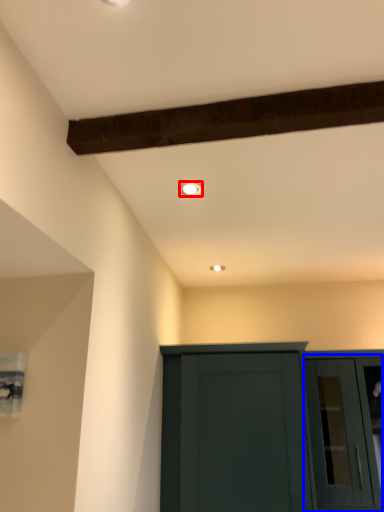
Question: Which object appears farthest to the camera in this image, lighting (highlighted by a red box) or glass door (highlighted by a blue box)?

Choices:
 (A) lighting
 (B) glass door

Answer: (B)